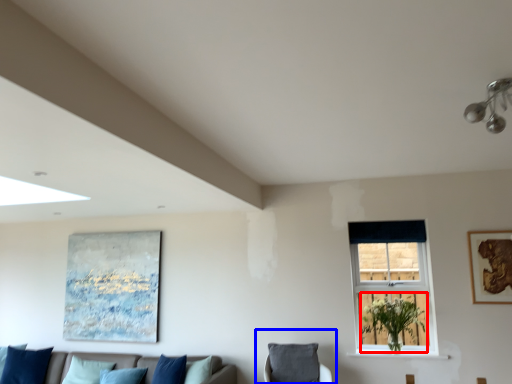
Question: Which of the following is the closest to the observer, plant (highlighted by a red box) or swivel chair (highlighted by a blue box)?

Choices:
 (A) plant
 (B) swivel chair

Answer: (B)